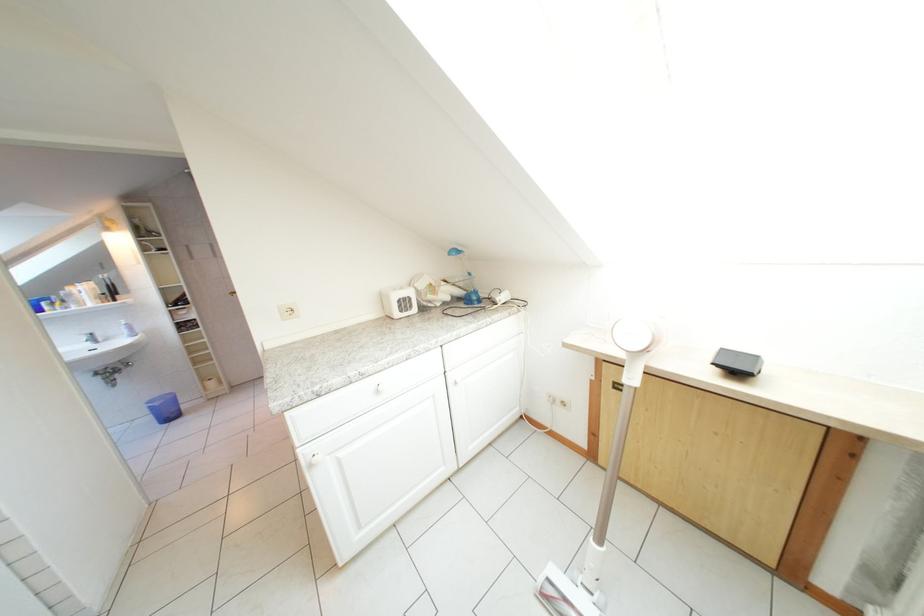
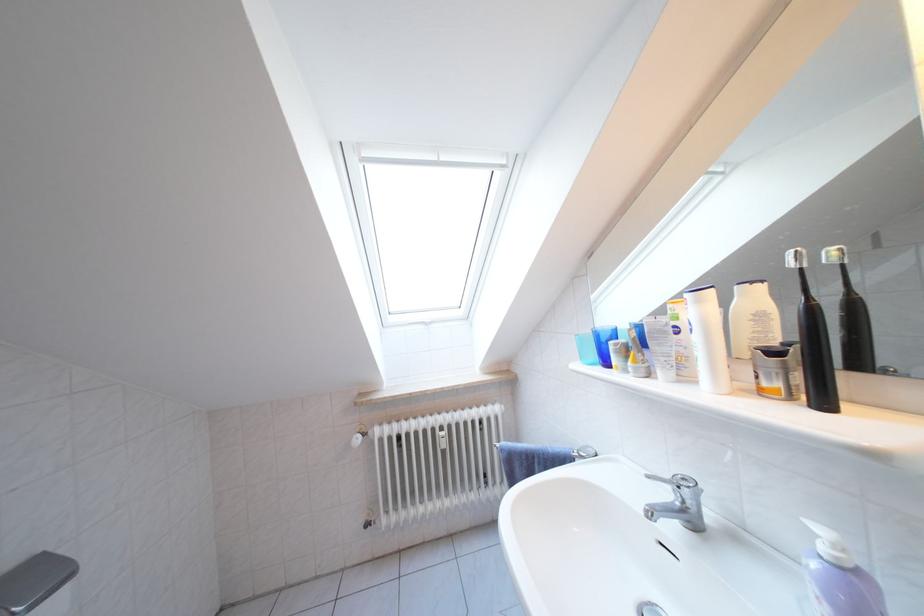
Locate, in the second image, the point that corresponds to pixel 94 342 in the first image.

(675, 500)